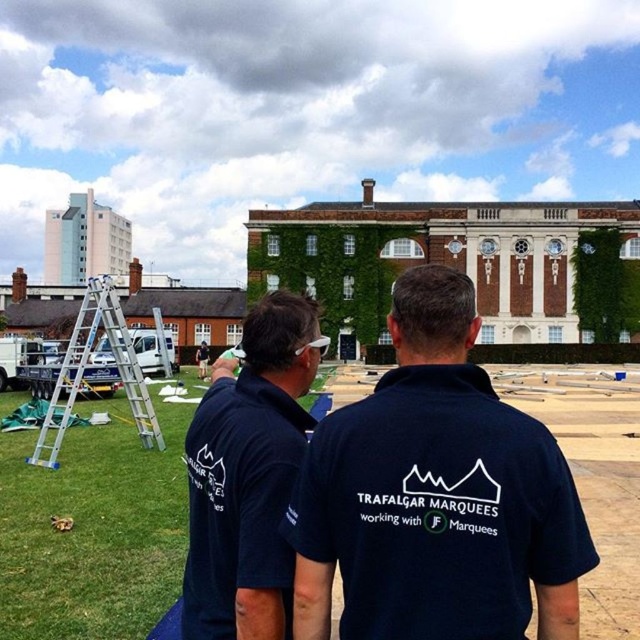
Who is positioned more to the right, navy blue shirt at center or silver/aluminum ladder at left?

Positioned to the right is navy blue shirt at center.

What do you see at coordinates (436, 496) in the screenshot?
I see `navy blue shirt at center` at bounding box center [436, 496].

This screenshot has width=640, height=640. I want to click on navy blue shirt at center, so click(436, 496).

Does dark blue polo shirt at center have a greater width compared to silver/aluminum ladder at left?

In fact, dark blue polo shirt at center might be narrower than silver/aluminum ladder at left.

The height and width of the screenshot is (640, 640). In order to click on dark blue polo shirt at center in this screenshot , I will do `click(248, 476)`.

Is point (214, 552) more distant than point (36, 452)?

No, (214, 552) is in front of (36, 452).

Locate an element on the screen. The image size is (640, 640). dark blue polo shirt at center is located at coordinates (248, 476).

Does navy blue shirt at center have a smaller size compared to dark blue polo shirt at center?

Incorrect, navy blue shirt at center is not smaller in size than dark blue polo shirt at center.

Does navy blue shirt at center have a lesser height compared to dark blue polo shirt at center?

No, navy blue shirt at center is not shorter than dark blue polo shirt at center.

What do you see at coordinates (436, 496) in the screenshot? I see `navy blue shirt at center` at bounding box center [436, 496].

I want to click on navy blue shirt at center, so click(x=436, y=496).